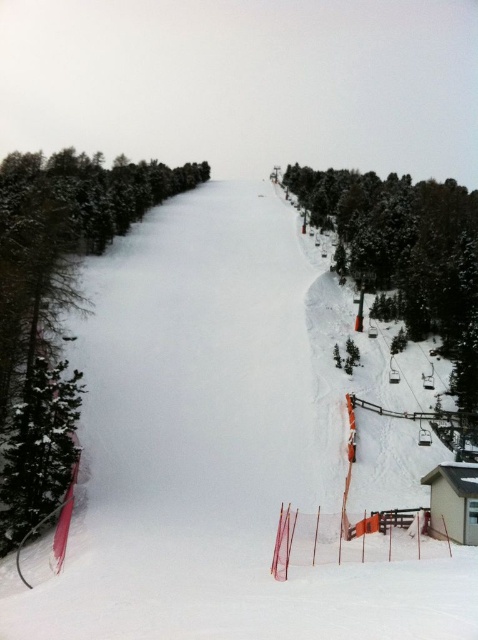
Question: Which of the following is the farthest from the observer?

Choices:
 (A) green matte tree at left
 (B) white snow ski slope at center

Answer: (A)

Question: Can you confirm if white snow ski slope at center is smaller than green matte tree at lower left?

Choices:
 (A) yes
 (B) no

Answer: (B)

Question: Where is white snow ski slope at center located in relation to green textured tree at right in the image?

Choices:
 (A) below
 (B) above

Answer: (A)

Question: Is white snow ski slope at center smaller than green matte tree at lower left?

Choices:
 (A) yes
 (B) no

Answer: (B)

Question: Which point is closer to the camera taking this photo?

Choices:
 (A) (60, 292)
 (B) (360, 243)

Answer: (A)

Question: Which object is closer to the camera taking this photo?

Choices:
 (A) white snow ski slope at center
 (B) green matte tree at left

Answer: (A)